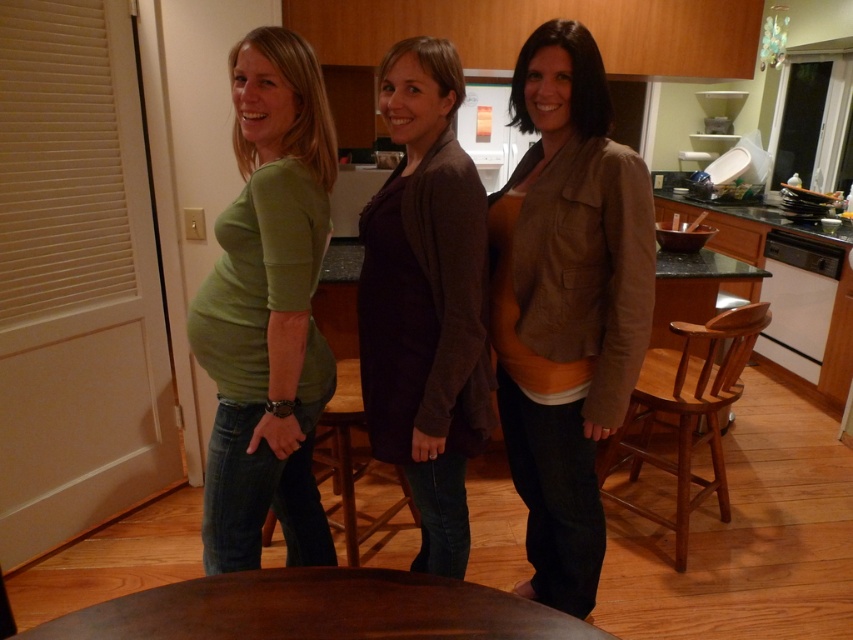
Question: Which of the following is the closest to the observer?

Choices:
 (A) (554, 401)
 (B) (282, 339)
 (C) (320, 618)

Answer: (C)

Question: Can you confirm if brown cotton jacket at center is wider than green matte shirt at left?

Choices:
 (A) yes
 (B) no

Answer: (A)

Question: Does dark brown sweater at center appear under brown wooden table at center?

Choices:
 (A) yes
 (B) no

Answer: (B)

Question: Can you confirm if brown cotton jacket at center is positioned above brown wooden table at center?

Choices:
 (A) no
 (B) yes

Answer: (B)

Question: Which object appears closest to the camera in this image?

Choices:
 (A) brown wooden table at center
 (B) brown cotton jacket at center
 (C) green matte shirt at left

Answer: (A)

Question: Which point is farther from the camera taking this photo?

Choices:
 (A) (300, 472)
 (B) (579, 417)

Answer: (A)